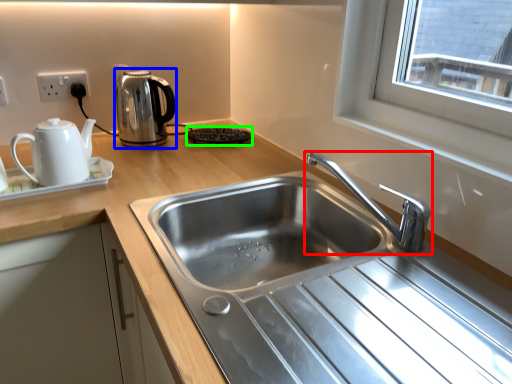
Question: Which object is the closest to the tap (highlighted by a red box)? Choose among these: kettle (highlighted by a blue box) or appliance (highlighted by a green box).

Choices:
 (A) kettle
 (B) appliance

Answer: (B)